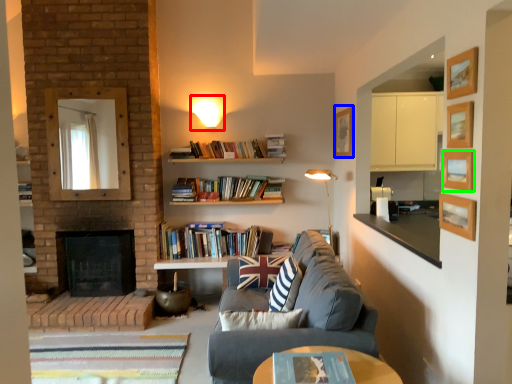
Question: Considering the real-world distances, which object is closest to light fixture (highlighted by a red box)? picture frame (highlighted by a blue box) or picture frame (highlighted by a green box).

Choices:
 (A) picture frame
 (B) picture frame

Answer: (A)